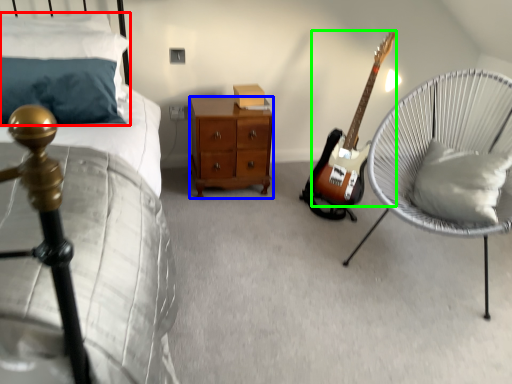
Question: Which object is the farthest from pillow (highlighted by a red box)? Choose among these: nightstand (highlighted by a blue box) or guitar (highlighted by a green box).

Choices:
 (A) nightstand
 (B) guitar

Answer: (B)